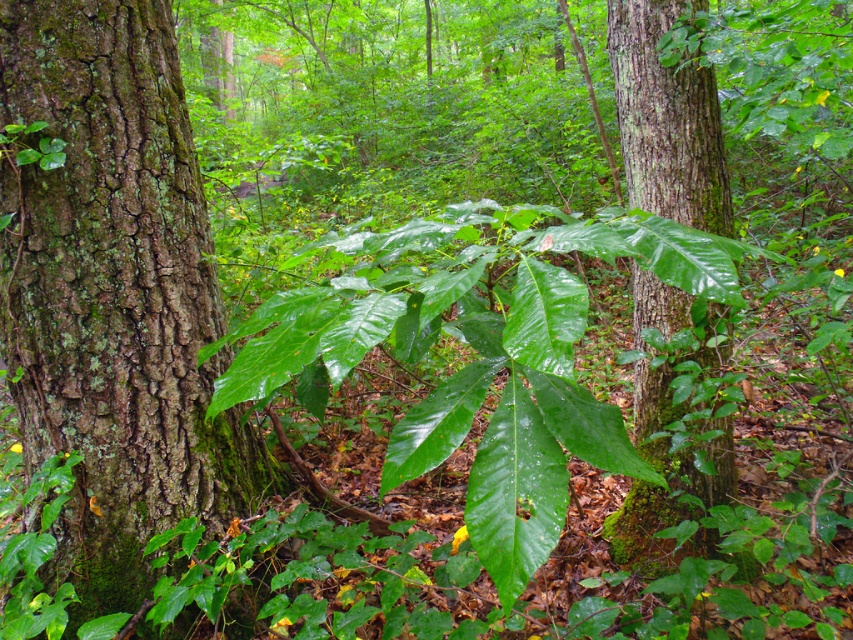
You are a hiker who has just arrived at this forest scene. You notice a point marked at coordinates (113, 291). Based on the scene description, what specific natural feature is located at this point?

The point at coordinates (113, 291) indicates green mossy bark at center.

You are a hiker trying to identify landmarks in the forest. You notice the green mossy bark at center and the green leafy tree at center. Which of these is positioned lower in the scene?

The green mossy bark at center is located below the green leafy tree at center, so it is positioned lower in the scene.

You are a hiker trying to determine which object is shorter between the green mossy bark at center and the green leafy tree at center. Based on the scene, which one is shorter?

The green mossy bark at center is shorter than the green leafy tree at center.